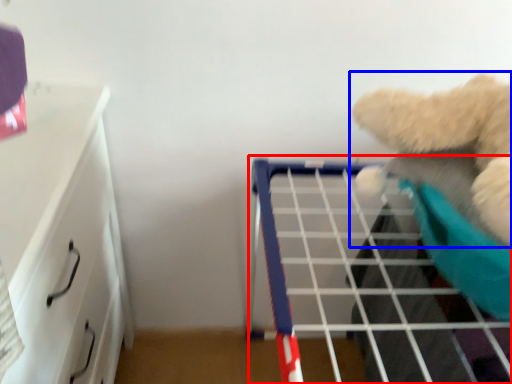
Question: Which object is closer to the camera taking this photo, shelf (highlighted by a red box) or teddy bear (highlighted by a blue box)?

Choices:
 (A) shelf
 (B) teddy bear

Answer: (B)